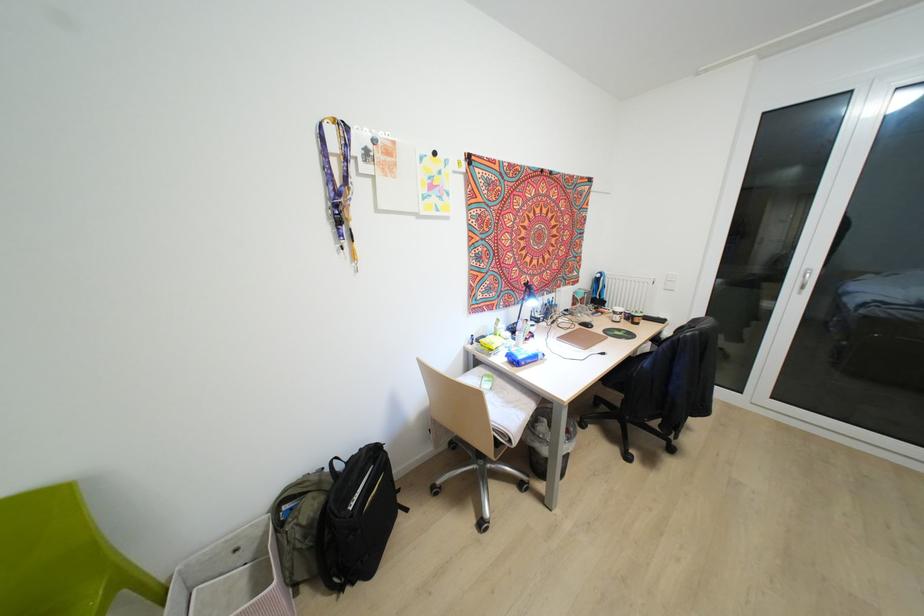
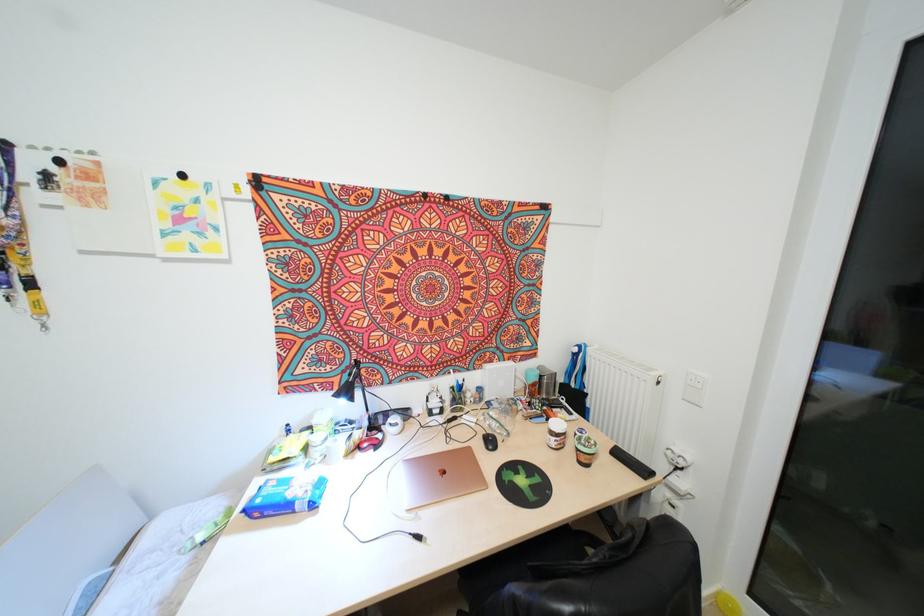
Where in the second image is the point corresponding to pixel 591 326 from the first image?

(494, 448)